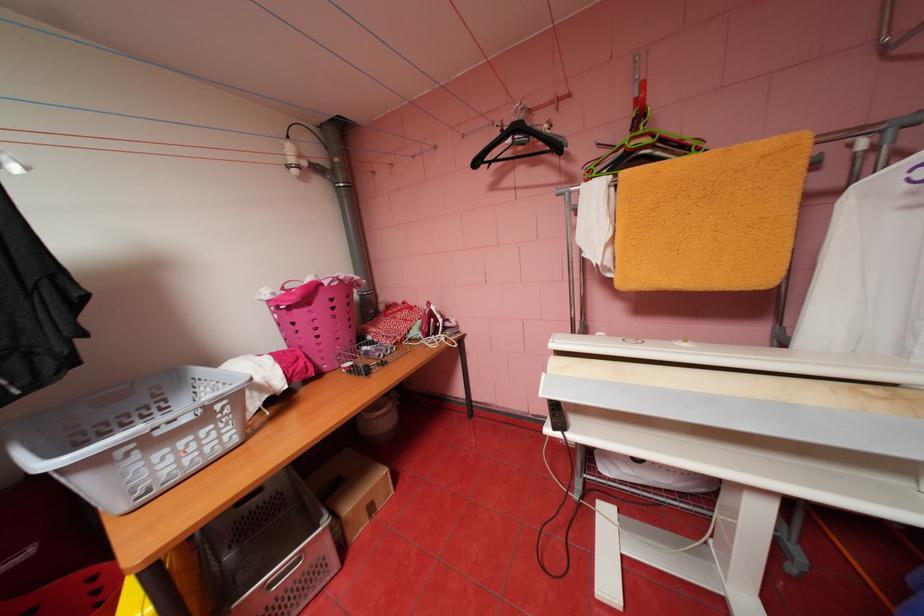
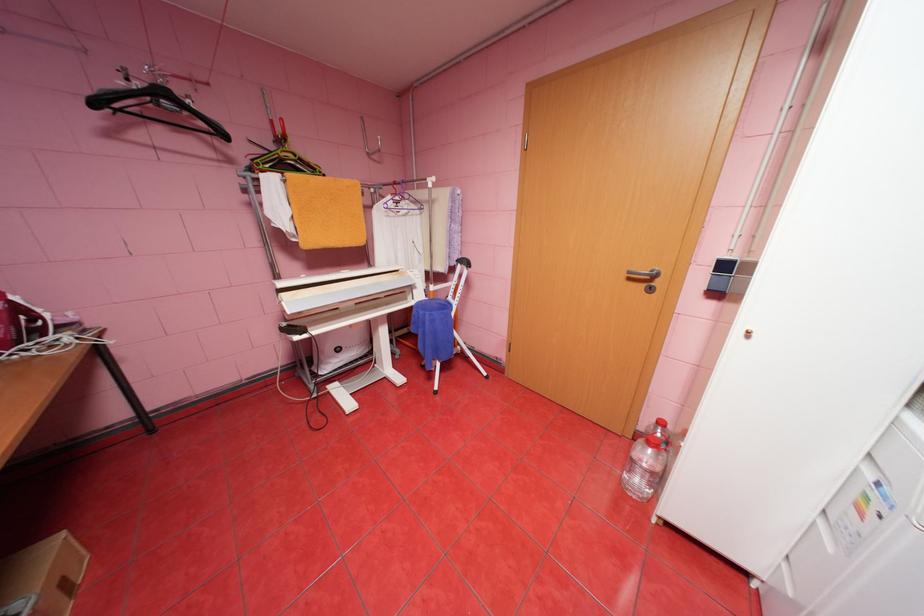
Locate, in the second image, the point that corresponds to point 484,163 in the first image.

(103, 103)